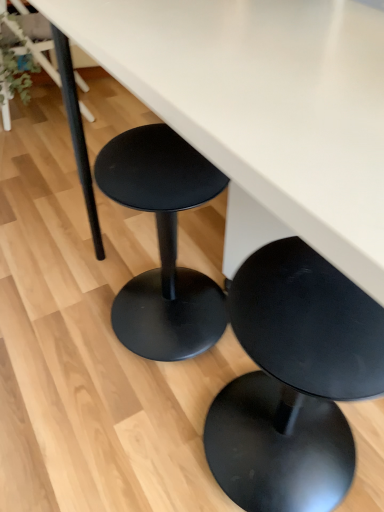
Question: Can you confirm if matte black stool at lower center is smaller than green matte plant at upper left?

Choices:
 (A) yes
 (B) no

Answer: (B)

Question: From the image's perspective, is matte black stool at lower center beneath green matte plant at upper left?

Choices:
 (A) no
 (B) yes

Answer: (B)

Question: Can you confirm if matte black stool at lower center is thinner than green matte plant at upper left?

Choices:
 (A) yes
 (B) no

Answer: (B)

Question: Are matte black stool at lower center and green matte plant at upper left located far from each other?

Choices:
 (A) no
 (B) yes

Answer: (B)

Question: Does matte black stool at lower center appear on the right side of green matte plant at upper left?

Choices:
 (A) no
 (B) yes

Answer: (B)

Question: Relative to matte black stool at lower center, is green matte plant at upper left in front or behind?

Choices:
 (A) behind
 (B) front

Answer: (A)

Question: Visually, is green matte plant at upper left positioned to the left or to the right of matte black stool at lower center?

Choices:
 (A) left
 (B) right

Answer: (A)

Question: Is green matte plant at upper left inside or outside of matte black stool at lower center?

Choices:
 (A) inside
 (B) outside

Answer: (B)

Question: From their relative heights in the image, would you say green matte plant at upper left is taller or shorter than matte black stool at lower center?

Choices:
 (A) short
 (B) tall

Answer: (A)

Question: Considering the positions of matte black stool at lower center and matte black stool at upper left in the image, is matte black stool at lower center wider or thinner than matte black stool at upper left?

Choices:
 (A) wide
 (B) thin

Answer: (A)

Question: Does point (244, 240) appear closer or farther from the camera than point (23, 14)?

Choices:
 (A) farther
 (B) closer

Answer: (B)

Question: In terms of height, does matte black stool at lower center look taller or shorter compared to matte black stool at upper left?

Choices:
 (A) tall
 (B) short

Answer: (A)

Question: Considering the relative positions of matte black stool at lower center and matte black stool at upper left in the image provided, is matte black stool at lower center to the left or to the right of matte black stool at upper left?

Choices:
 (A) right
 (B) left

Answer: (A)

Question: Is green matte plant at upper left situated inside matte black stool at upper left or outside?

Choices:
 (A) outside
 (B) inside

Answer: (A)

Question: Is green matte plant at upper left bigger or smaller than matte black stool at upper left?

Choices:
 (A) small
 (B) big

Answer: (A)